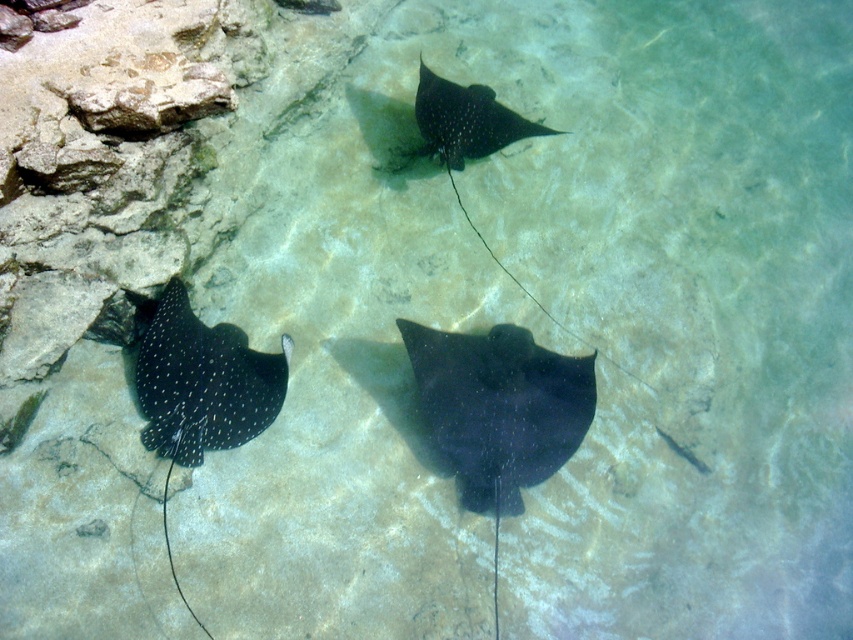
Question: Considering the real-world distances, which object is closest to the black glossy stingray at upper center?

Choices:
 (A) black glossy stingray at center
 (B) black dotted stingray at lower left

Answer: (A)

Question: Among these objects, which one is farthest from the camera?

Choices:
 (A) black glossy stingray at center
 (B) black glossy stingray at upper center

Answer: (B)

Question: Which object is positioned closest to the black glossy stingray at center?

Choices:
 (A) black glossy stingray at upper center
 (B) black dotted stingray at lower left

Answer: (B)

Question: Does black glossy stingray at center come in front of black glossy stingray at upper center?

Choices:
 (A) yes
 (B) no

Answer: (A)

Question: Does black glossy stingray at center have a smaller size compared to black dotted stingray at lower left?

Choices:
 (A) no
 (B) yes

Answer: (A)

Question: Can you confirm if black dotted stingray at lower left is smaller than black glossy stingray at upper center?

Choices:
 (A) no
 (B) yes

Answer: (A)